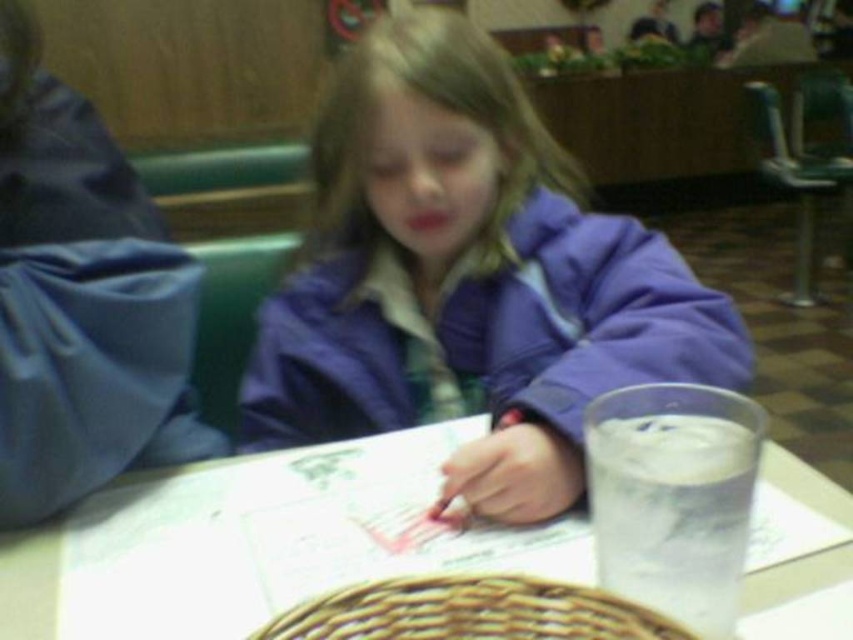
You are a photographer trying to capture a closeup of the purple matte jacket at center. Since the white glossy table at center is in the way, can you lower your camera to get the shot without moving the table?

The purple matte jacket at center is much taller than the white glossy table at center, so lowering the camera might allow you to capture the jacket without obstruction from the table.

You are a photographer trying to capture the child focused on their drawing. You need to position your camera so that both the purple matte jacket at center and the white glossy table at center are in the frame. Based on their positions, which object should be placed on the left side of the frame?

The white glossy table at center should be placed on the left side of the frame because the purple matte jacket at center is to the right of it.

You are a photographer trying to capture the purple matte jacket at center in a closeup shot. The camera has a focus point at coordinates 0.434 on the x axis and 0.549 on the y axis. Will the jacket be in focus?

Yes, the purple matte jacket at center is exactly at the focus point coordinates 0.434 on the x axis and 0.549 on the y axis, so it will be in focus.